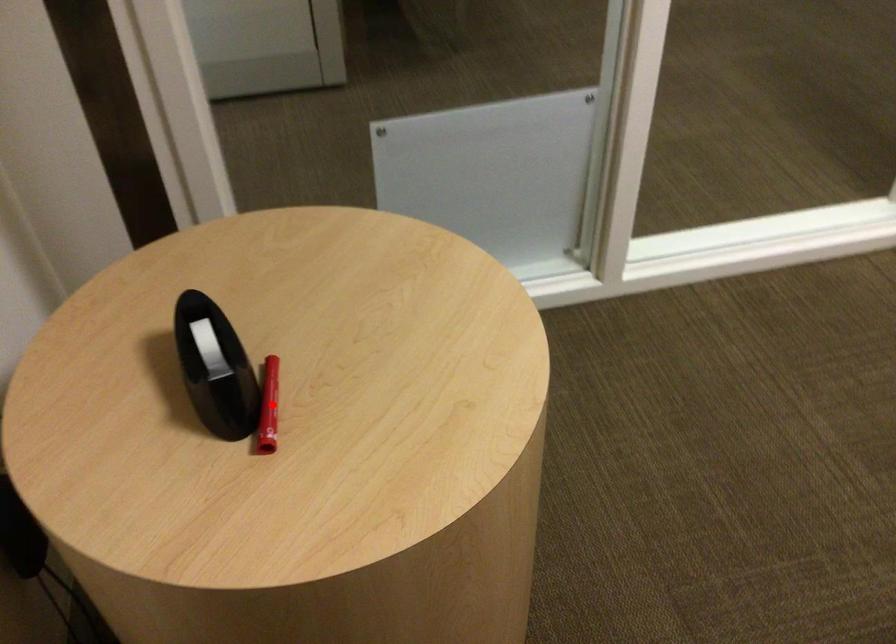
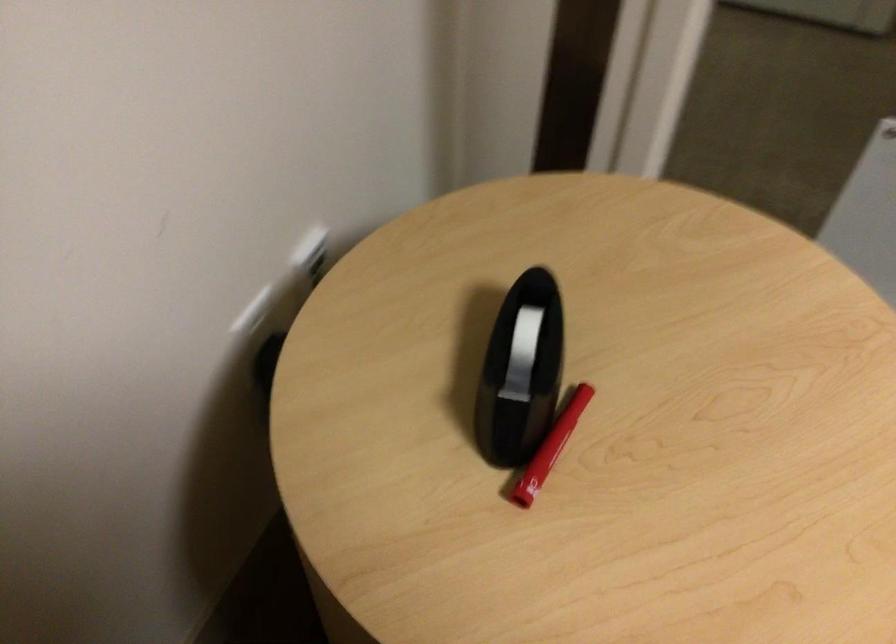
Find the pixel in the second image that matches the highlighted location in the first image.

(557, 438)